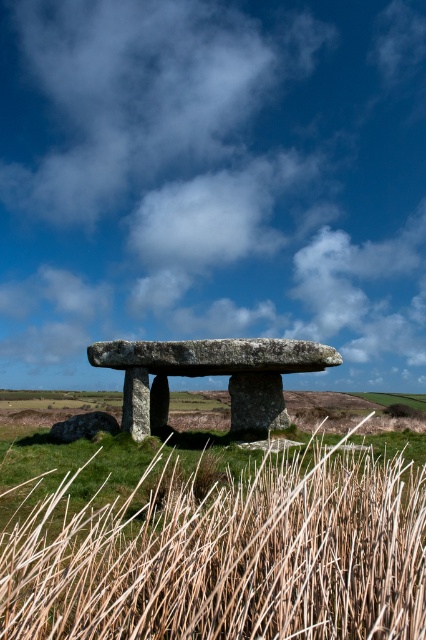
Is white fluffy cloud at upper center thinner than rough stone dolmen at center?

No, white fluffy cloud at upper center is not thinner than rough stone dolmen at center.

Is white fluffy cloud at upper center to the right of rough stone dolmen at center from the viewer's perspective?

No, white fluffy cloud at upper center is not to the right of rough stone dolmen at center.

Identify the location of white fluffy cloud at upper center. The height and width of the screenshot is (640, 426). (213, 182).

Between point (305, 76) and point (163, 637), which one is positioned in front?

Point (163, 637)

Locate an element on the screen. The width and height of the screenshot is (426, 640). white fluffy cloud at upper center is located at coordinates (213, 182).

The image size is (426, 640). I want to click on white fluffy cloud at upper center, so click(x=213, y=182).

Does brown textured reed at lower left appear over rough stone dolmen at center?

Indeed, brown textured reed at lower left is positioned over rough stone dolmen at center.

What do you see at coordinates (227, 557) in the screenshot? I see `brown textured reed at lower left` at bounding box center [227, 557].

What are the coordinates of `brown textured reed at lower left` in the screenshot? It's located at (227, 557).